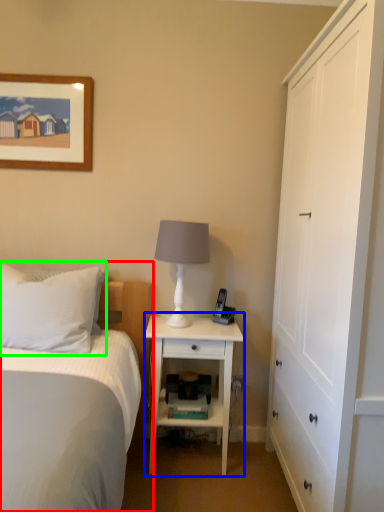
Question: Which is farther away from bed (highlighted by a red box)? nightstand (highlighted by a blue box) or pillow (highlighted by a green box)?

Choices:
 (A) nightstand
 (B) pillow

Answer: (A)